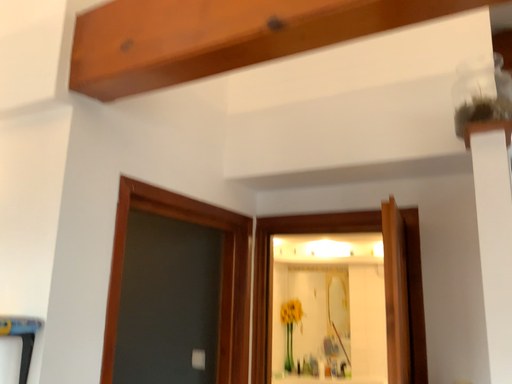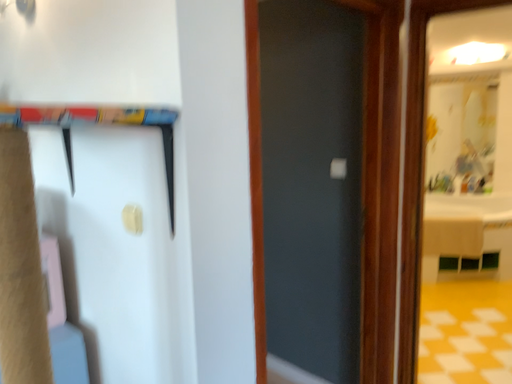
Question: How did the camera likely rotate when shooting the video?

Choices:
 (A) rotated downward
 (B) rotated upward

Answer: (A)